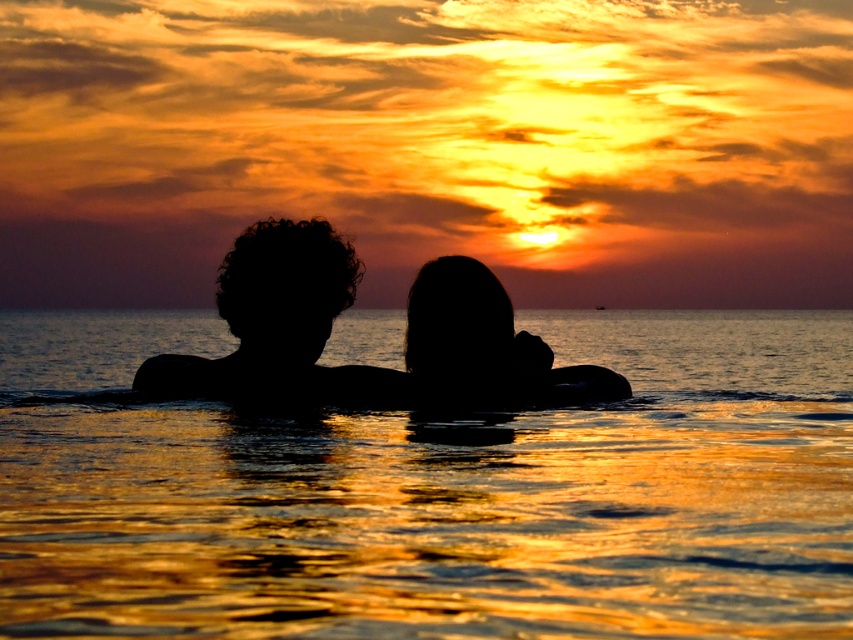
You are a photographer trying to capture the sunset. You notice the golden reflective water at center and the silhouette hair at center in your frame. Which object should you focus on to ensure it appears bigger in your photo?

The golden reflective water at center is larger in size than the silhouette hair at center, so focusing on it will ensure a bigger appearance in the photo.

Consider the image. You are standing at the point with coordinates point (512, 344) and want to move to the point with coordinates point (402, 396). According to the scene description, is the destination point in front of or behind your current position?

The point (402, 396) is behind point (512, 344), so the destination point is behind your current position.